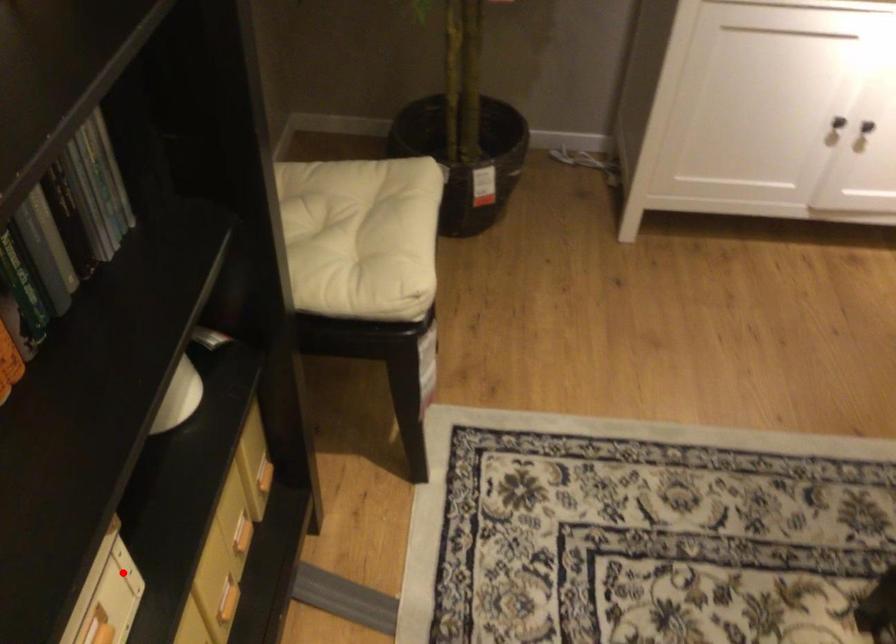
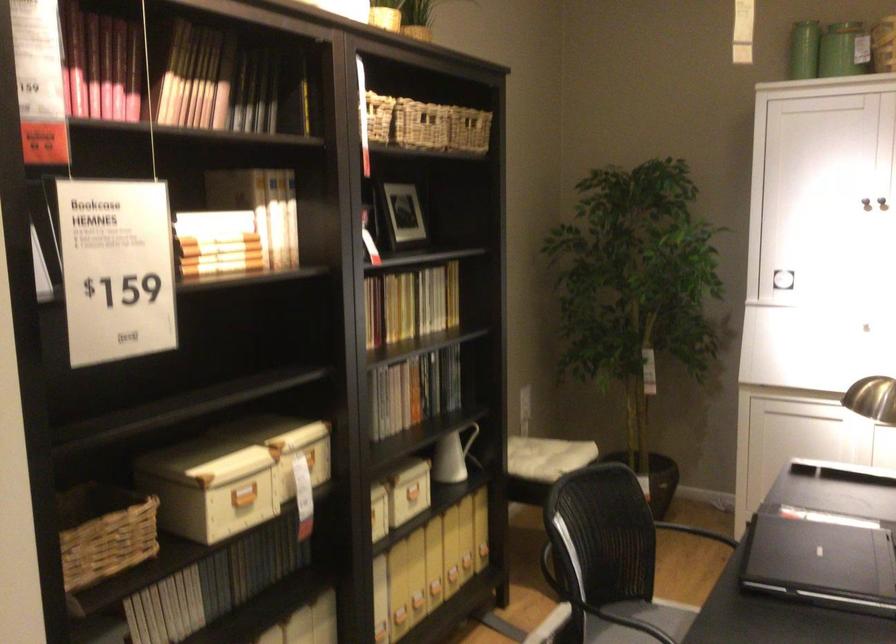
Where in the second image is the point corresponding to the highlighted location from the first image?

(418, 491)